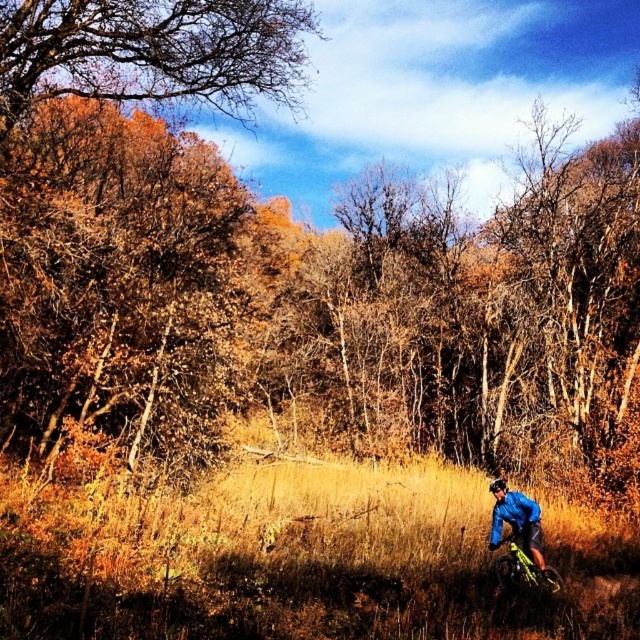
You are a photographer planning to capture a wide shot of the scene. You need to ensure both the matte blue jacket at lower right and the yellow metallic bicycle at lower right are fully visible in the frame. Given their sizes, which object requires more space horizontally in the photo?

The matte blue jacket at lower right requires more horizontal space in the photo because its width is larger than the yellow metallic bicycle at lower right.

From the picture: You are a photographer standing in the forest and want to capture a photo of both the matte blue jacket at lower right and the yellow metallic bicycle at lower right. Based on their positions, which object should you focus on first to ensure both are in the frame?

The matte blue jacket at lower right is much taller than the yellow metallic bicycle at lower right. To ensure both are in the frame, you should focus on the matte blue jacket at lower right first, as its height may require adjusting the camera angle to include the entire jacket and the bicycle simultaneously.

You are a photographer standing in the forest scene. You want to take a photo of the mountain biker and two specific points in the image, point A at coordinates point (520, 525) and point B at coordinates point (536, 582). Which point should you focus on first if you want to ensure both points are in focus?

You should focus on point A at coordinates point (520, 525) first because it is closer to the camera than point B at coordinates point (536, 582). By focusing on the closer point, the farther point will also be within the depth of field, ensuring both are in focus.